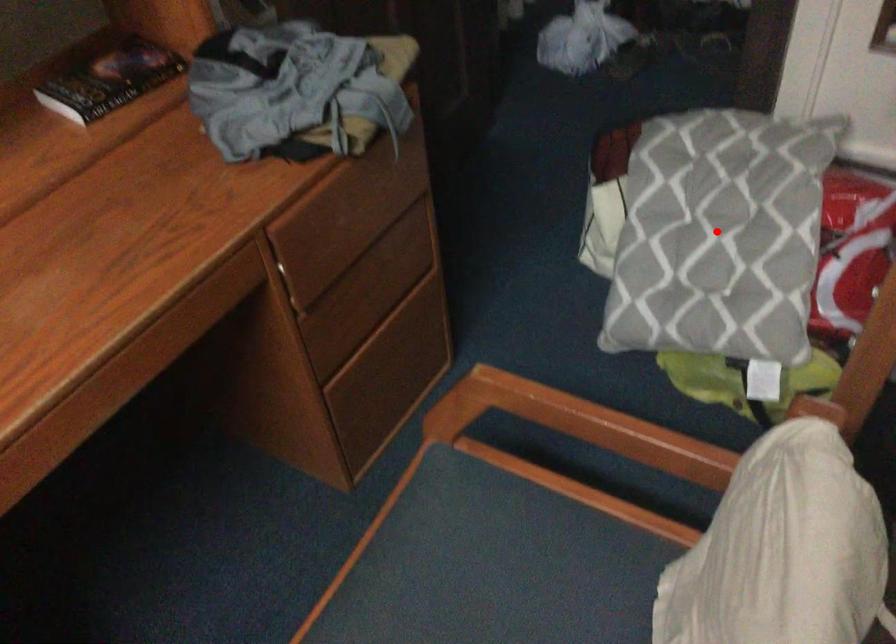
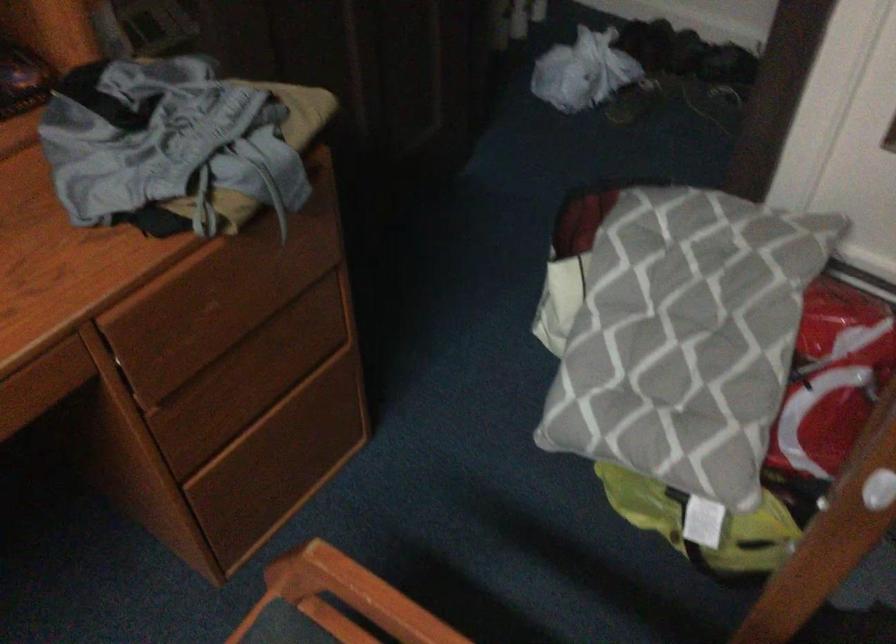
Question: I am providing you with two images of the same scene from different viewpoints. A red point is shown in image1. For the corresponding object point in image2, is it positioned nearer or farther from the camera?

Choices:
 (A) Nearer
 (B) Farther

Answer: (A)